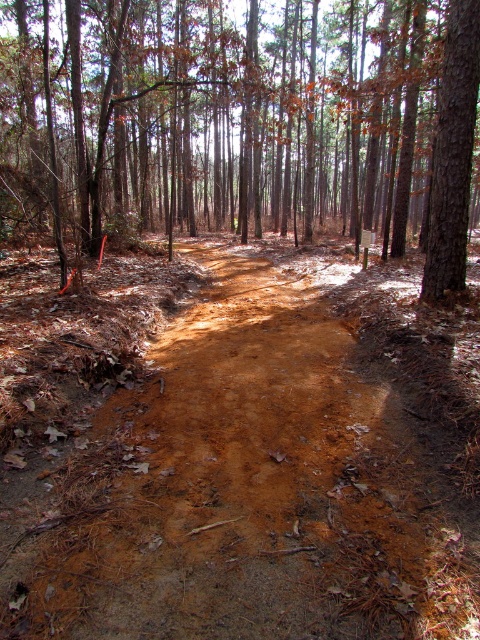
Question: Can you confirm if brown sandy dirt track at center is wider than brown bark tree at center?

Choices:
 (A) no
 (B) yes

Answer: (A)

Question: Which of these objects is positioned closest to the brown bark tree at center?

Choices:
 (A) brown rough tree at upper right
 (B) brown sandy dirt track at center

Answer: (B)

Question: Among these points, which one is nearest to the camera?

Choices:
 (A) (454, 138)
 (B) (223, 531)

Answer: (B)

Question: Is brown sandy dirt track at center to the right of brown bark tree at center from the viewer's perspective?

Choices:
 (A) yes
 (B) no

Answer: (A)

Question: Which point is closer to the camera taking this photo?

Choices:
 (A) (180, 598)
 (B) (385, 257)
 (C) (464, 56)

Answer: (A)

Question: Does brown sandy dirt track at center have a greater width compared to brown rough tree at upper right?

Choices:
 (A) no
 (B) yes

Answer: (B)